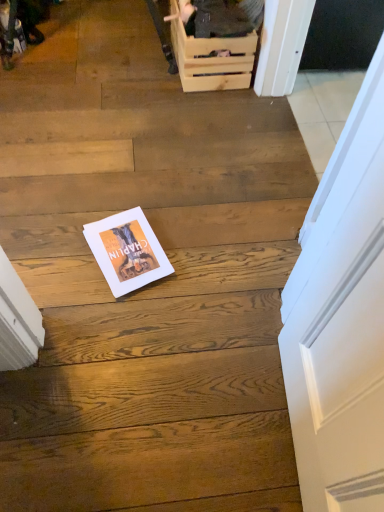
Locate an element on the screen. vacant space in front of white paper magazine at center is located at coordinates (103, 300).